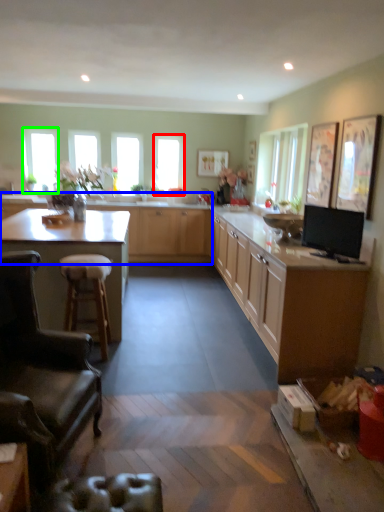
Question: Considering the real-world distances, which object is farthest from window (highlighted by a red box)? cabinetry (highlighted by a blue box) or window (highlighted by a green box)?

Choices:
 (A) cabinetry
 (B) window

Answer: (B)